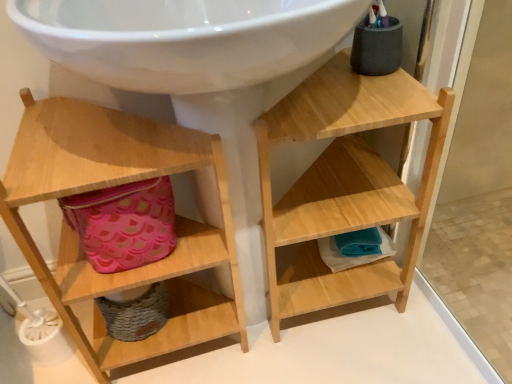
Question: Is pink fabric basket at lower left behind natural wood shelf at upper right, the 2th shelf from the left?

Choices:
 (A) yes
 (B) no

Answer: (A)

Question: Is pink fabric basket at lower left far from natural wood shelf at upper right, the 2th shelf from the left?

Choices:
 (A) yes
 (B) no

Answer: (B)

Question: Considering the relative positions of pink fabric basket at lower left and natural wood shelf at upper right, the 1th shelf when ordered from right to left, in the image provided, is pink fabric basket at lower left to the left of natural wood shelf at upper right, the 1th shelf when ordered from right to left, from the viewer's perspective?

Choices:
 (A) yes
 (B) no

Answer: (A)

Question: Is pink fabric basket at lower left wider than natural wood shelf at upper right, the 2th shelf from the left?

Choices:
 (A) yes
 (B) no

Answer: (B)

Question: Does pink fabric basket at lower left appear on the right side of natural wood shelf at upper right, the 1th shelf when ordered from right to left?

Choices:
 (A) no
 (B) yes

Answer: (A)

Question: Is pink fabric basket at lower left oriented away from natural wood shelf at upper right, the 1th shelf when ordered from right to left?

Choices:
 (A) yes
 (B) no

Answer: (B)

Question: Considering the relative sizes of wooden shelf at left, which is counted as the 2th shelf, starting from the right, and pink fabric basket at lower left in the image provided, is wooden shelf at left, which is counted as the 2th shelf, starting from the right, shorter than pink fabric basket at lower left?

Choices:
 (A) no
 (B) yes

Answer: (A)

Question: Is wooden shelf at left, the first shelf from the left, not inside pink fabric basket at lower left?

Choices:
 (A) no
 (B) yes

Answer: (B)

Question: Is wooden shelf at left, the first shelf from the left, positioned in front of pink fabric basket at lower left?

Choices:
 (A) yes
 (B) no

Answer: (A)

Question: From the image's perspective, is wooden shelf at left, which is counted as the 2th shelf, starting from the right, below pink fabric basket at lower left?

Choices:
 (A) no
 (B) yes

Answer: (B)

Question: Can you confirm if wooden shelf at left, which is counted as the 2th shelf, starting from the right, is bigger than pink fabric basket at lower left?

Choices:
 (A) yes
 (B) no

Answer: (A)

Question: Are wooden shelf at left, the first shelf from the left, and pink fabric basket at lower left far apart?

Choices:
 (A) no
 (B) yes

Answer: (A)

Question: Is natural wood shelf at upper right, the 1th shelf when ordered from right to left, outside pink fabric basket at lower left?

Choices:
 (A) no
 (B) yes

Answer: (B)